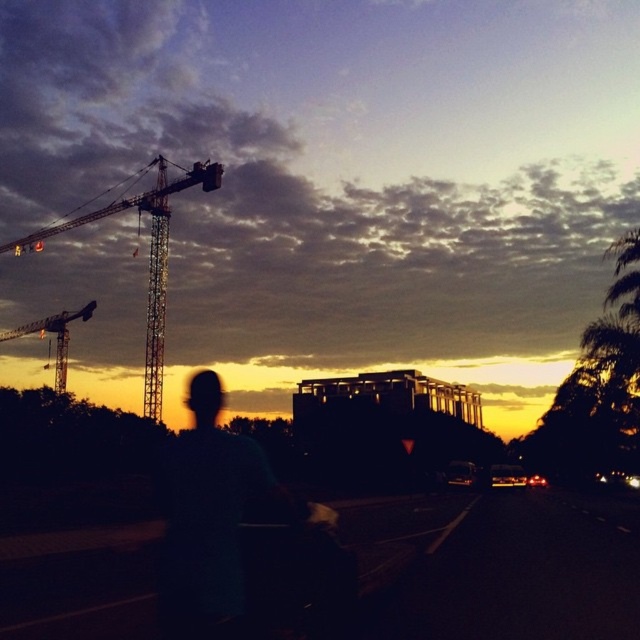
Question: Is matte black construction crane at upper left to the left of metallic construction crane at upper left from the viewer's perspective?

Choices:
 (A) yes
 (B) no

Answer: (B)

Question: Is matte black construction crane at upper left further to the viewer compared to metallic silver crane at left?

Choices:
 (A) yes
 (B) no

Answer: (A)

Question: Does matte black construction crane at upper left have a larger size compared to metallic construction crane at upper left?

Choices:
 (A) yes
 (B) no

Answer: (A)

Question: Which point is closer to the camera taking this photo?

Choices:
 (A) (161, 221)
 (B) (58, 376)
 (C) (408, 76)

Answer: (A)

Question: Estimate the real-world distances between objects in this image. Which object is farther from the matte black construction crane at upper left?

Choices:
 (A) metallic construction crane at upper left
 (B) metallic silver crane at left

Answer: (A)

Question: Which point is farther to the camera?

Choices:
 (A) metallic construction crane at upper left
 (B) metallic silver crane at left
 (C) matte black construction crane at upper left

Answer: (A)